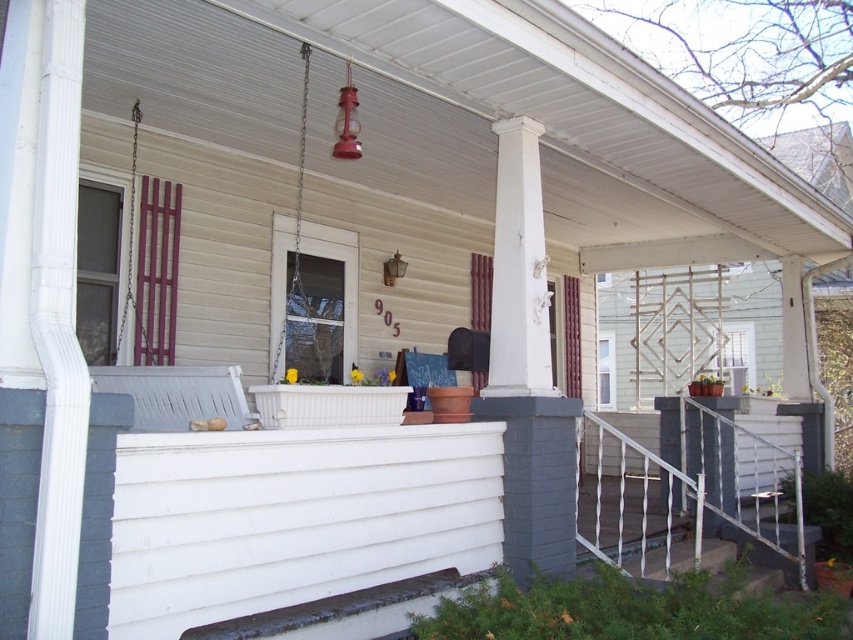
Who is positioned more to the left, white metal railing at lower right or metallic chain swing at center?

metallic chain swing at center is more to the left.

Measure the distance between point (595, 550) and camera.

Point (595, 550) and camera are 4.82 meters apart from each other.

Between point (727, 536) and point (314, 342), which one is positioned in front?

Point (727, 536) is more forward.

This screenshot has width=853, height=640. I want to click on white metal railing at lower right, so click(688, 493).